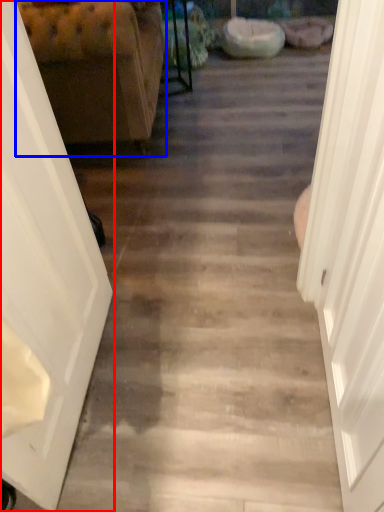
Question: Which of the following is the closest to the observer, door (highlighted by a red box) or furniture (highlighted by a blue box)?

Choices:
 (A) door
 (B) furniture

Answer: (A)